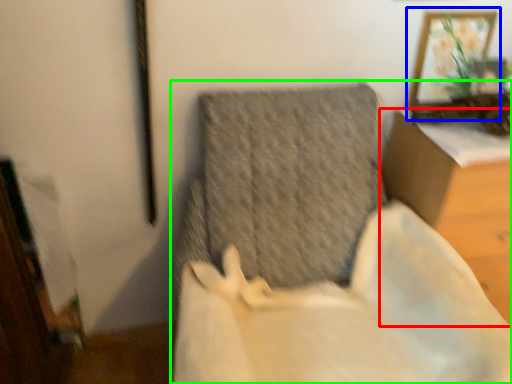
Question: Considering the real-world distances, which object is closest to furniture (highlighted by a red box)? picture frame (highlighted by a blue box) or furniture (highlighted by a green box).

Choices:
 (A) picture frame
 (B) furniture

Answer: (A)